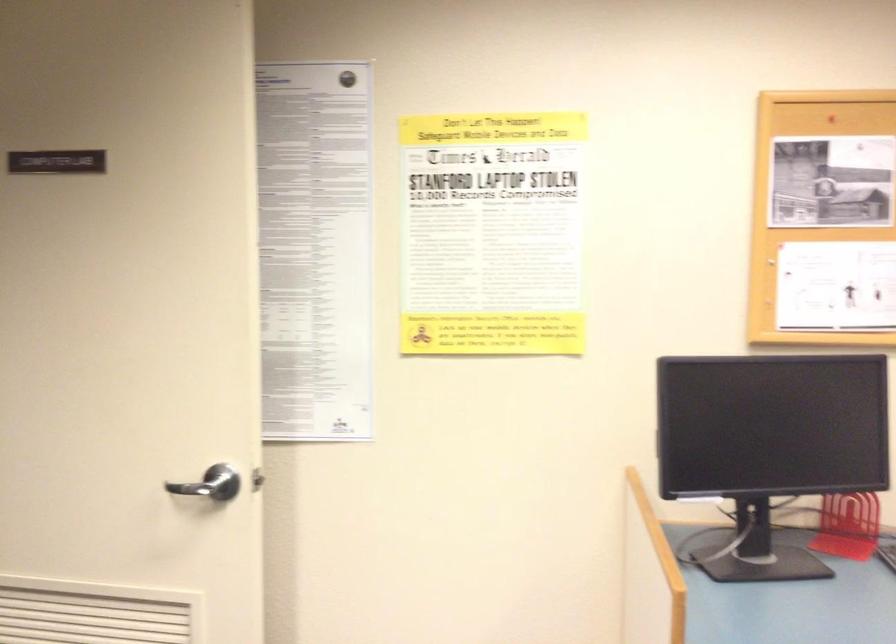
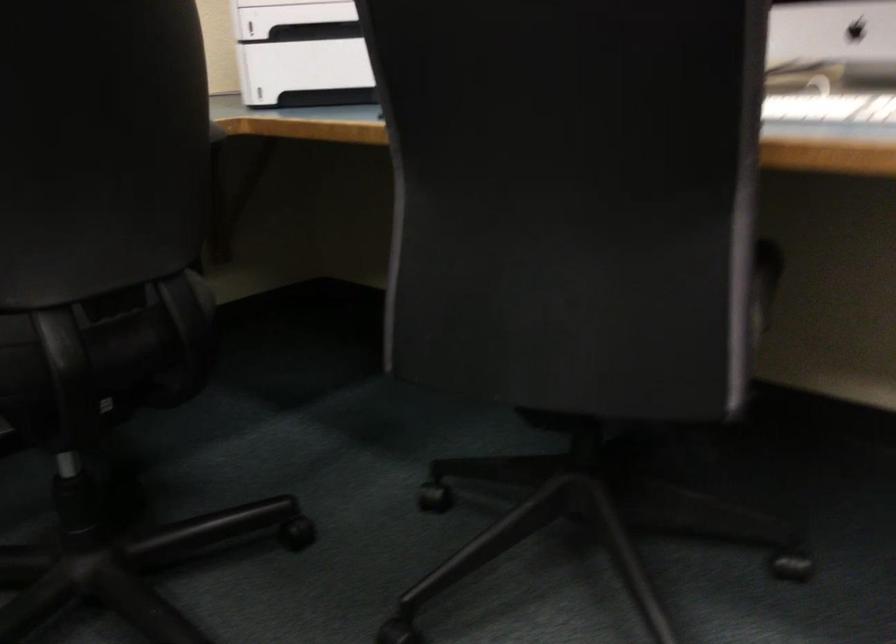
How did the camera likely rotate?

The camera's rotation is toward right-down.